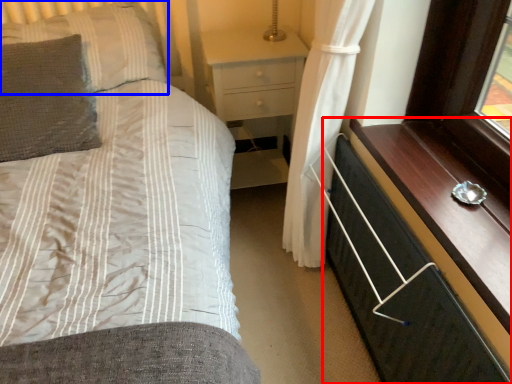
Question: Which object is closer to the camera taking this photo, chest of drawers (highlighted by a red box) or pillow (highlighted by a blue box)?

Choices:
 (A) chest of drawers
 (B) pillow

Answer: (A)